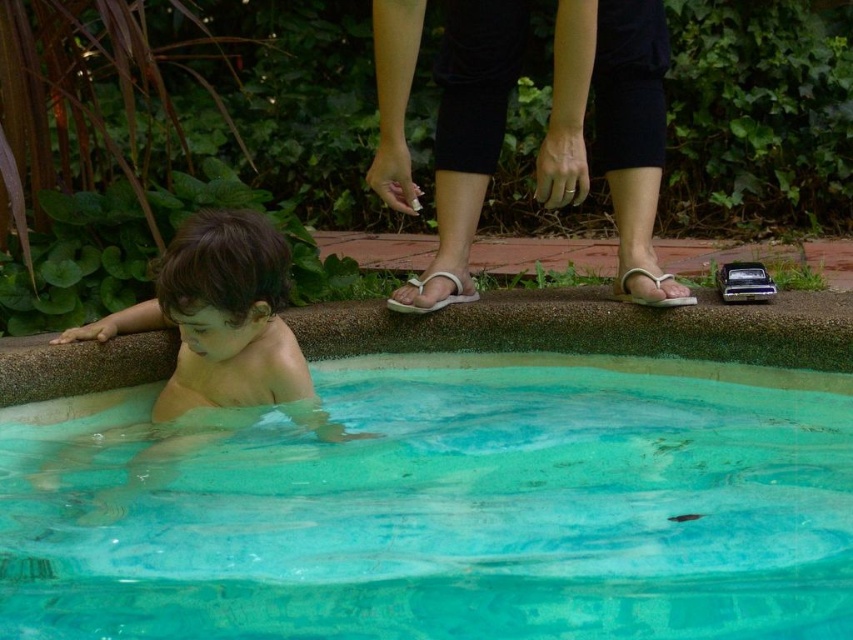
Question: Estimate the real-world distances between objects in this image. Which object is closer to the white rubber sandal at center?

Choices:
 (A) smooth skin child at lower left
 (B) white fabric sandal at center

Answer: (B)

Question: Is white leather sandals at center smaller than white rubber sandal at center?

Choices:
 (A) no
 (B) yes

Answer: (A)

Question: Considering the relative positions of white leather sandals at center and smooth skin child at lower left in the image provided, where is white leather sandals at center located with respect to smooth skin child at lower left?

Choices:
 (A) right
 (B) left

Answer: (A)

Question: Which object is positioned closest to the white rubber sandal at center?

Choices:
 (A) white leather sandals at center
 (B) clear plastic water at lower center
 (C) white fabric sandal at center

Answer: (A)

Question: Is clear plastic water at lower center positioned in front of white fabric sandal at center?

Choices:
 (A) no
 (B) yes

Answer: (B)

Question: Which of the following is the closest to the observer?

Choices:
 (A) (102, 332)
 (B) (640, 269)
 (C) (450, 280)
 (D) (641, 264)

Answer: (A)